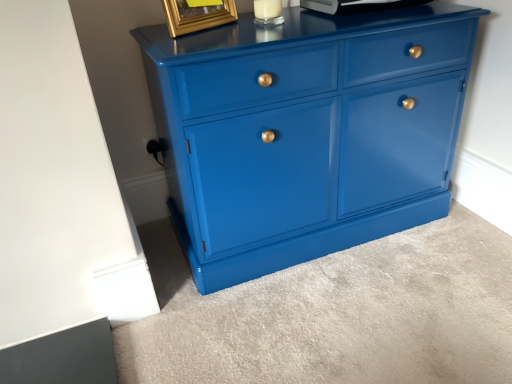
Question: From the image's perspective, would you say glossy blue cabinet at center is shown under gold metallic picture frame at upper center?

Choices:
 (A) yes
 (B) no

Answer: (A)

Question: Considering the relative positions of glossy blue cabinet at center and gold metallic picture frame at upper center in the image provided, is glossy blue cabinet at center to the left of gold metallic picture frame at upper center from the viewer's perspective?

Choices:
 (A) yes
 (B) no

Answer: (B)

Question: Considering the relative positions of glossy blue cabinet at center and gold metallic picture frame at upper center in the image provided, is glossy blue cabinet at center in front of gold metallic picture frame at upper center?

Choices:
 (A) no
 (B) yes

Answer: (B)

Question: Considering the relative sizes of glossy blue cabinet at center and gold metallic picture frame at upper center in the image provided, is glossy blue cabinet at center thinner than gold metallic picture frame at upper center?

Choices:
 (A) no
 (B) yes

Answer: (A)

Question: Is glossy blue cabinet at center not close to gold metallic picture frame at upper center?

Choices:
 (A) yes
 (B) no

Answer: (B)

Question: Considering the positions of metallic silver appliance at upper center and gold metallic picture frame at upper center in the image, is metallic silver appliance at upper center taller or shorter than gold metallic picture frame at upper center?

Choices:
 (A) tall
 (B) short

Answer: (B)

Question: Considering the positions of metallic silver appliance at upper center and gold metallic picture frame at upper center in the image, is metallic silver appliance at upper center bigger or smaller than gold metallic picture frame at upper center?

Choices:
 (A) big
 (B) small

Answer: (A)

Question: Which is correct: metallic silver appliance at upper center is inside gold metallic picture frame at upper center, or outside of it?

Choices:
 (A) inside
 (B) outside

Answer: (B)

Question: From the image's perspective, is metallic silver appliance at upper center located above or below gold metallic picture frame at upper center?

Choices:
 (A) above
 (B) below

Answer: (A)

Question: Is point (248, 61) positioned closer to the camera than point (165, 16)?

Choices:
 (A) closer
 (B) farther

Answer: (A)

Question: Considering the relative positions of glossy blue cabinet at center and gold metallic picture frame at upper center in the image provided, is glossy blue cabinet at center to the left or to the right of gold metallic picture frame at upper center?

Choices:
 (A) left
 (B) right

Answer: (B)

Question: Is glossy blue cabinet at center bigger or smaller than gold metallic picture frame at upper center?

Choices:
 (A) small
 (B) big

Answer: (B)

Question: In terms of width, does glossy blue cabinet at center look wider or thinner when compared to gold metallic picture frame at upper center?

Choices:
 (A) thin
 (B) wide

Answer: (B)

Question: Looking at their shapes, would you say metallic silver appliance at upper center is wider or thinner than glossy blue cabinet at center?

Choices:
 (A) thin
 (B) wide

Answer: (A)

Question: From a real-world perspective, is metallic silver appliance at upper center positioned above or below glossy blue cabinet at center?

Choices:
 (A) below
 (B) above

Answer: (B)